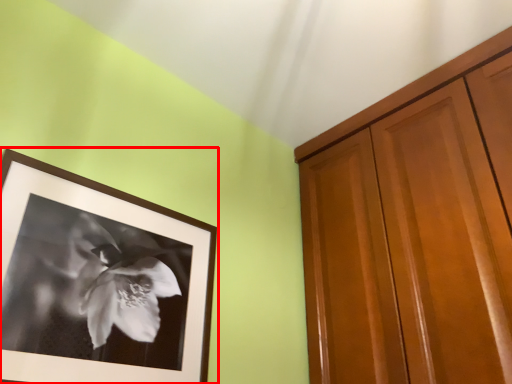
Question: From the image's perspective, where is picture frame (annotated by the red box) located in relation to cabinetry in the image?

Choices:
 (A) above
 (B) below

Answer: (B)